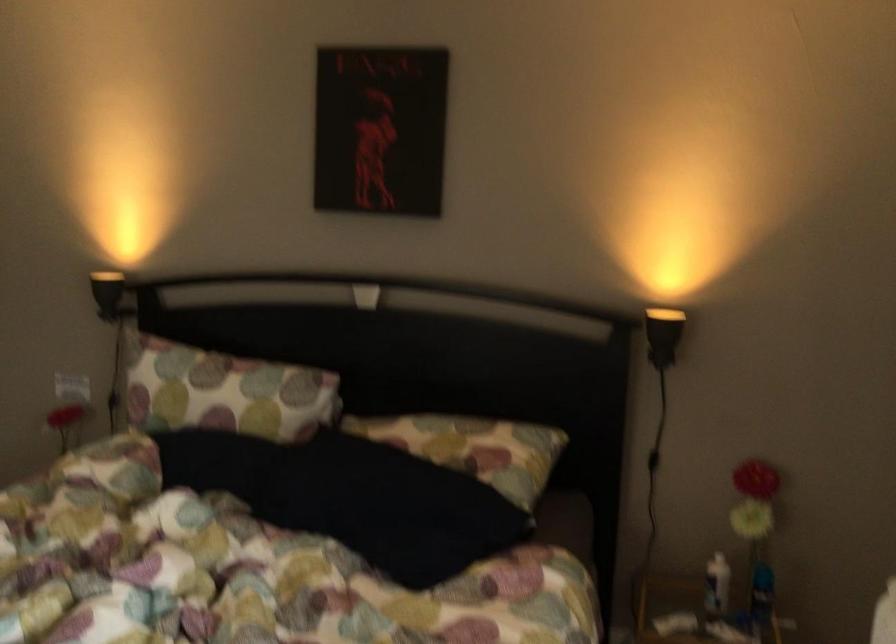
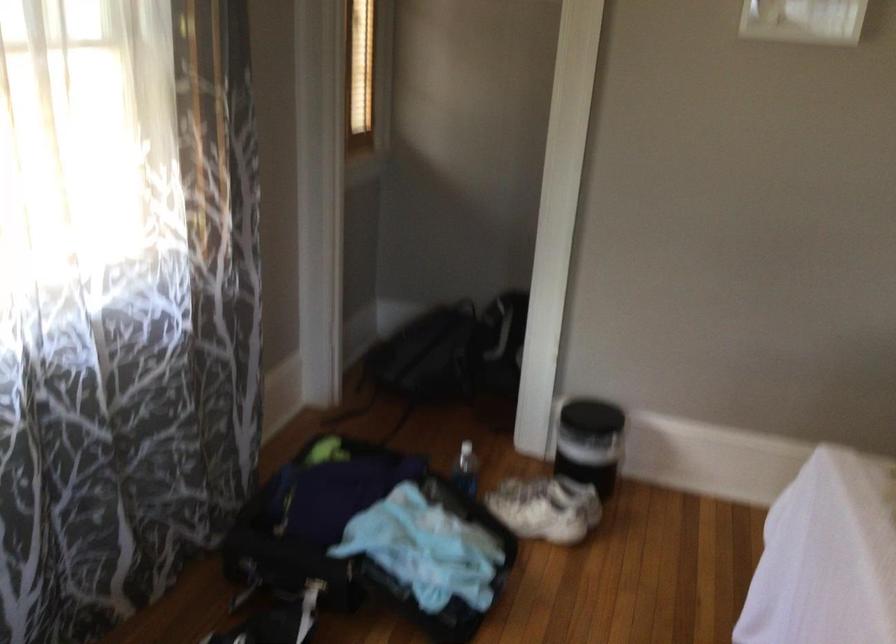
Consider the image. How did the camera likely rotate?

The camera's rotation is toward left-down.